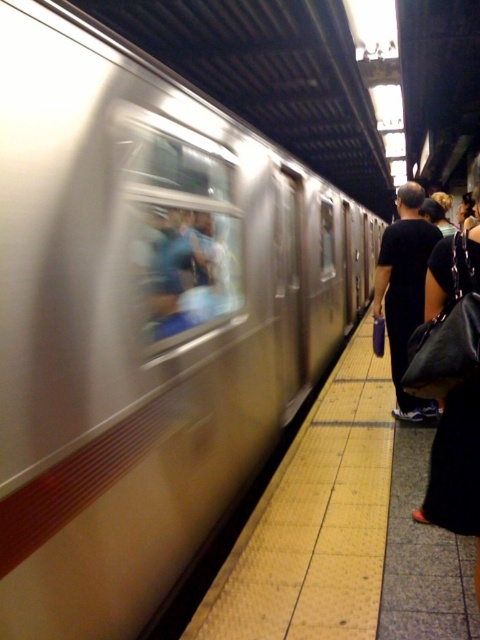
Is yellow tile platform at center closer to the viewer compared to black fabric bag at right?

That is True.

Is point (463, 609) farther from viewer compared to point (408, 218)?

That is False.

Is point (319, 422) less distant than point (380, 310)?

No, (319, 422) is further to viewer.

Where is `yellow tile platform at center`? The height and width of the screenshot is (640, 480). yellow tile platform at center is located at coordinates (344, 531).